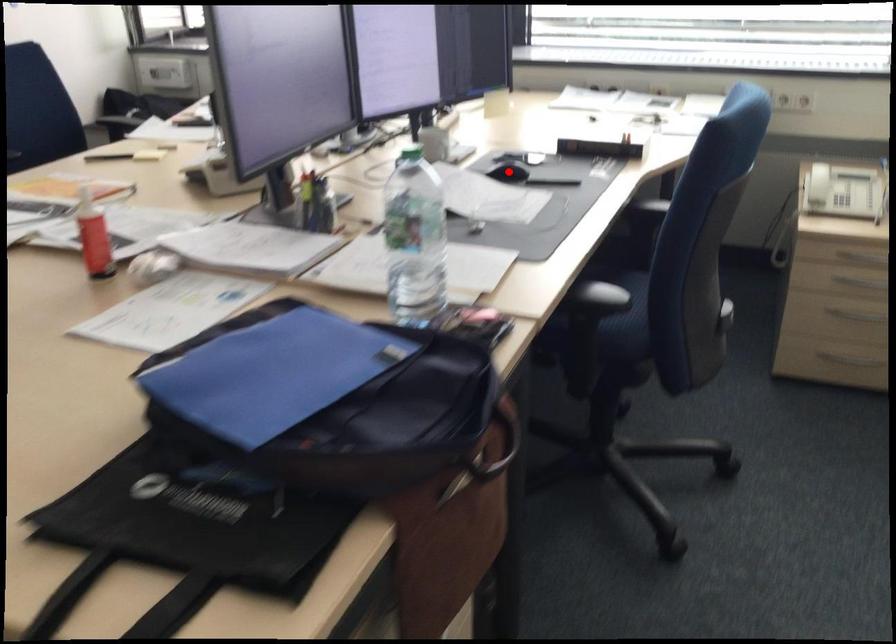
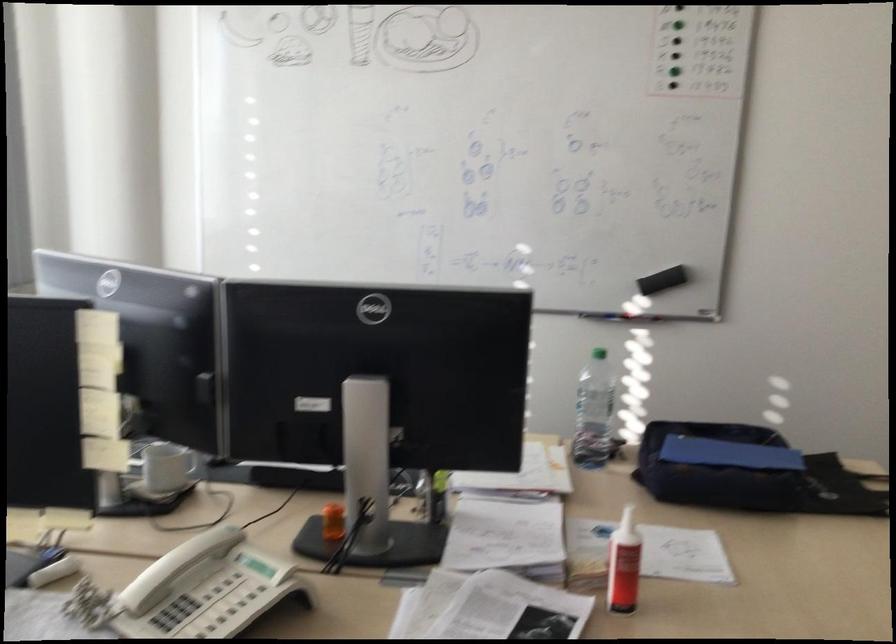
Question: I am providing you with two images of the same scene from different viewpoints. A red point is marked on the first image. Can you still see the location of the red point in image 2?

Choices:
 (A) Yes
 (B) No

Answer: (B)